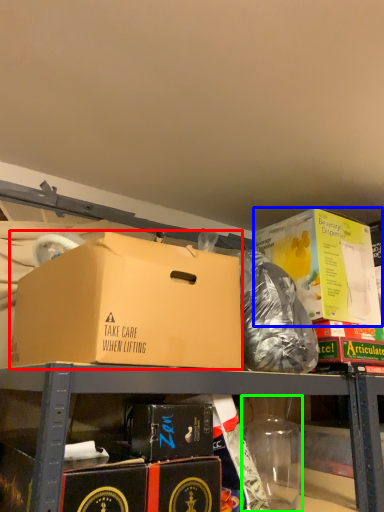
Question: Which is farther away from box (highlighted by a red box)? box (highlighted by a blue box) or bottle (highlighted by a green box)?

Choices:
 (A) box
 (B) bottle

Answer: (A)